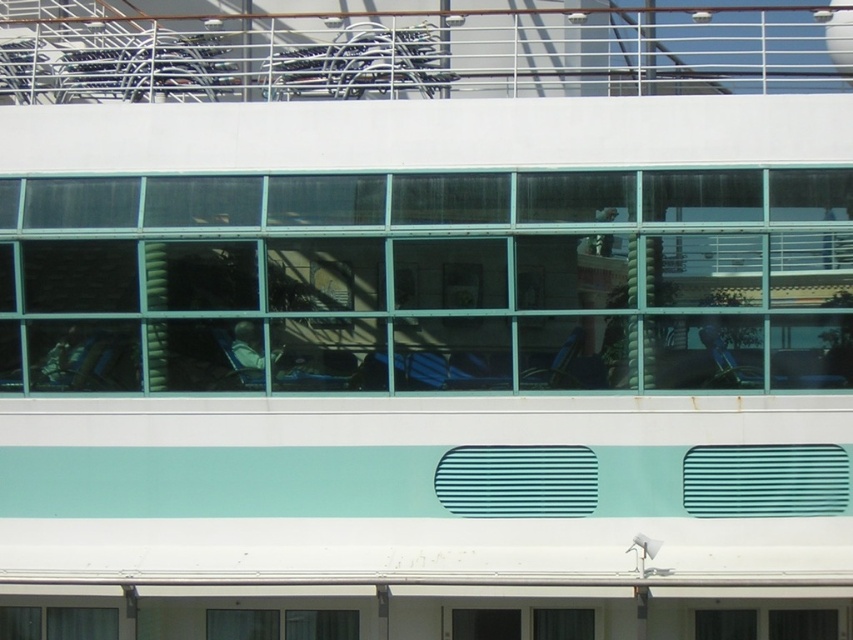
Question: Can you confirm if white metal railing at upper center is bigger than clear glass window at lower center?

Choices:
 (A) yes
 (B) no

Answer: (A)

Question: Is transparent glass windows at center smaller than white metal railing at upper center?

Choices:
 (A) yes
 (B) no

Answer: (A)

Question: Estimate the real-world distances between objects in this image. Which object is farther from the clear glass window at lower center?

Choices:
 (A) white metal railing at upper center
 (B) transparent glass windows at center

Answer: (A)

Question: Among these objects, which one is nearest to the camera?

Choices:
 (A) clear glass window at lower center
 (B) transparent glass windows at center

Answer: (B)

Question: Which object appears closest to the camera in this image?

Choices:
 (A) clear glass window at lower center
 (B) white metal railing at upper center
 (C) transparent glass windows at center

Answer: (B)

Question: Is transparent glass windows at center above white metal railing at upper center?

Choices:
 (A) yes
 (B) no

Answer: (B)